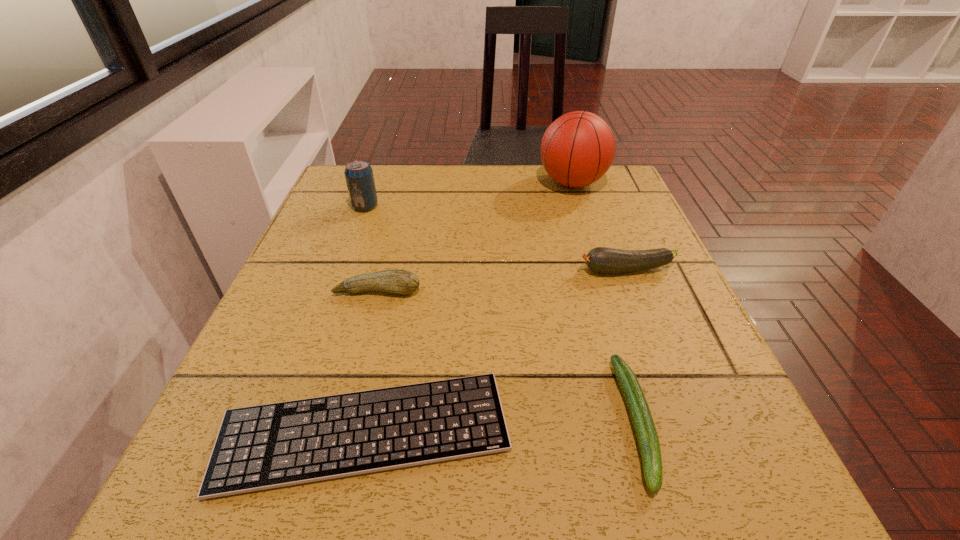
Find the location of a particular element. This screenshot has height=540, width=960. free location located 0.080m at the blossom end of the third farthest object is located at coordinates click(x=537, y=270).

This screenshot has height=540, width=960. In order to click on vacant region located at the blossom end of the third farthest object in this screenshot , I will do `click(421, 270)`.

Identify the location of free space located 0.180m at the blossom end of the third farthest object. (487, 270).

At what (x,y) coordinates should I click in order to perform the action: click on vacant space located at the stem end of the leftmost zucchini. Please return your answer as a coordinate pair (x, y). Looking at the image, I should click on (330, 476).

Where is `free location located on the right of the computer keyboard`? The image size is (960, 540). free location located on the right of the computer keyboard is located at coordinates (738, 431).

Locate an element on the screen. basketball that is at the far edge is located at coordinates (577, 149).

The width and height of the screenshot is (960, 540). In order to click on pop soda that is at the far edge in this screenshot , I will do `click(359, 177)`.

Where is `zucchini that is at the near edge`? This screenshot has width=960, height=540. zucchini that is at the near edge is located at coordinates click(646, 433).

Where is `computer keyboard situated at the near edge`? The height and width of the screenshot is (540, 960). computer keyboard situated at the near edge is located at coordinates (267, 446).

I want to click on pop soda at the left edge, so click(x=359, y=177).